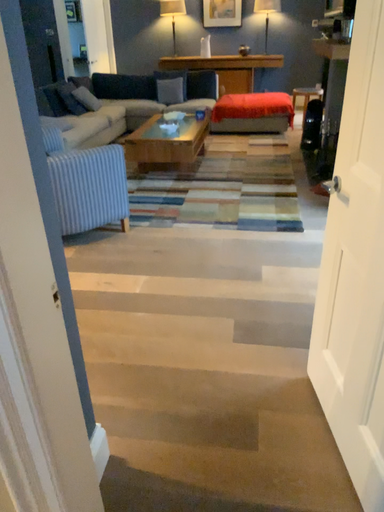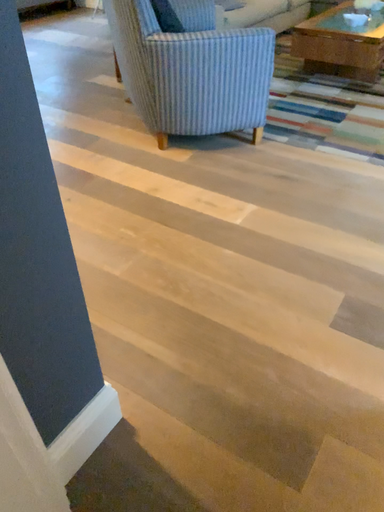
Question: Which way did the camera rotate in the video?

Choices:
 (A) rotated downward
 (B) rotated upward

Answer: (A)